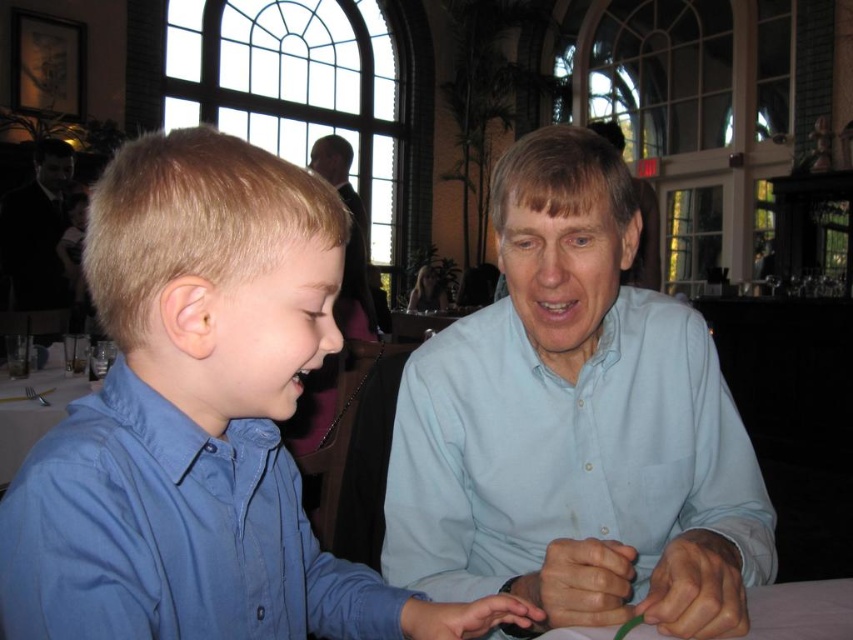
You are a photographer planning to take a group photo of the dark suit at left and the white glossy table at lower left. Since you want to ensure both subjects are clearly visible in the photo, which one should you focus on first considering their sizes?

The dark suit at left has a larger size compared to the white glossy table at lower left, so you should focus on the dark suit at left first to ensure it is in clear focus before adjusting for the smaller subject.